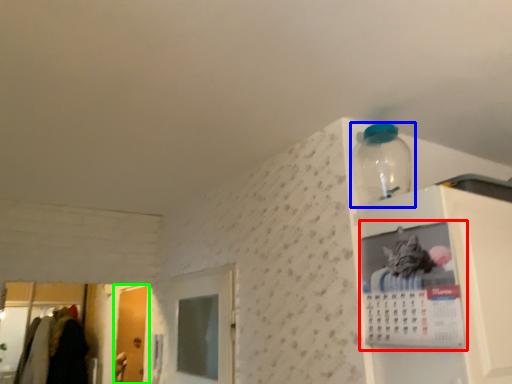
Question: Considering the real-world distances, which object is closest to cabinet (highlighted by a red box)? bottle (highlighted by a blue box) or door (highlighted by a green box).

Choices:
 (A) bottle
 (B) door

Answer: (A)